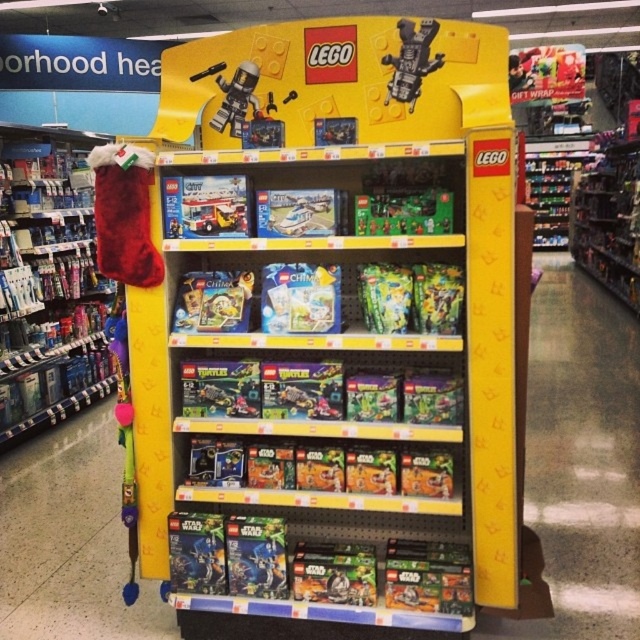
Question: Which object appears closest to the camera in this image?

Choices:
 (A) velvet red stocking at left
 (B) metallic silver robot at upper center

Answer: (B)

Question: Where is velvet red stocking at left located in relation to metallic silver robot at upper center in the image?

Choices:
 (A) above
 (B) below

Answer: (B)

Question: Is velvet red stocking at left behind metallic silver robot at upper center?

Choices:
 (A) yes
 (B) no

Answer: (A)

Question: Can you confirm if velvet red stocking at left is thinner than metallic silver robot at upper center?

Choices:
 (A) no
 (B) yes

Answer: (A)